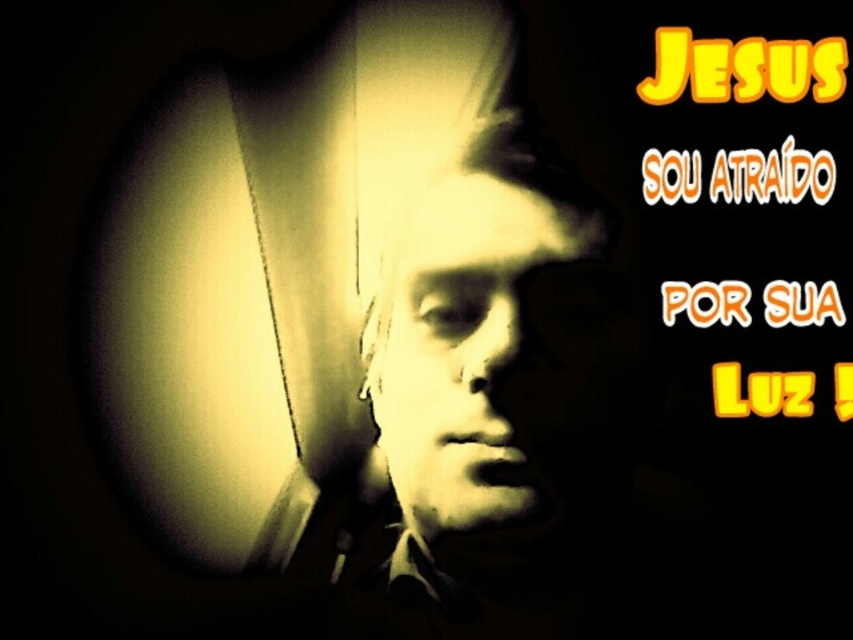
You are designing a poster for a religious event and need to ensure the text and faces are properly spaced. The poster requires that the distance between the two faces must be exactly 0.5 inches. Given that the matte black face at center and the matte yellow face at center are currently 0.46 inches apart, will the spacing meet the requirement?

The matte black face at center and the matte yellow face at center are currently 0.46 inches apart, which is slightly less than the required 0.5 inches. Therefore, the spacing does not meet the requirement and needs to be adjusted to increase the distance between them.